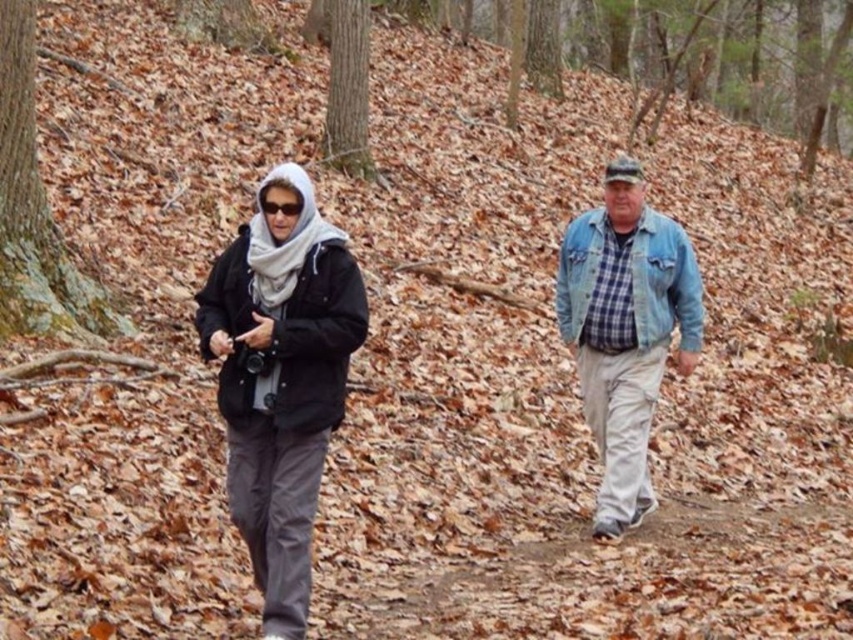
Between black matte jacket at left and denim jacket at right, which one appears on the left side from the viewer's perspective?

black matte jacket at left

Between point (303, 240) and point (556, 275), which one is positioned behind?

Positioned behind is point (556, 275).

Find the location of `black matte jacket at left`. black matte jacket at left is located at coordinates (281, 378).

Does point (312, 260) lie behind point (302, 381)?

Yes, it is.

Does black matte jacket at center have a lesser height compared to black matte jacket at left?

Yes.

Who is more forward, (282, 170) or (310, 396)?

Point (310, 396) is more forward.

Locate an element on the screen. black matte jacket at center is located at coordinates (274, 385).

Is black matte jacket at center closer to camera compared to denim jacket at right?

No, it is behind denim jacket at right.

Does point (572, 310) come behind point (677, 353)?

No, (572, 310) is closer to viewer.

Is point (252, 224) closer to viewer compared to point (688, 333)?

Yes, it is in front of point (688, 333).

Locate an element on the screen. The image size is (853, 640). black matte jacket at center is located at coordinates (274, 385).